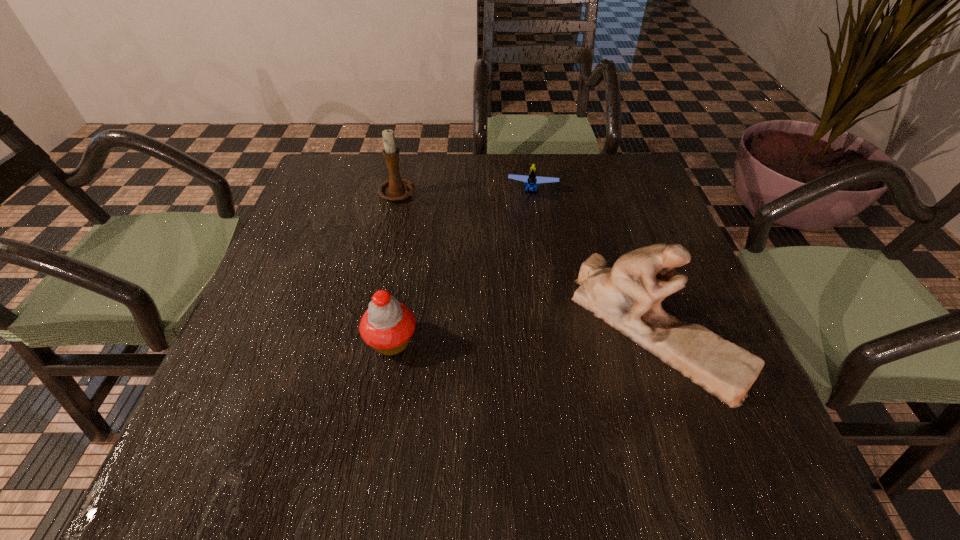
Identify the location of vacant space located 0.130m on the side of the candle holder with the handle. This screenshot has width=960, height=540. (433, 231).

The width and height of the screenshot is (960, 540). What are the coordinates of `Lego that is at the far edge` in the screenshot? It's located at (531, 181).

Locate an element on the screen. This screenshot has width=960, height=540. candle holder at the far edge is located at coordinates (396, 188).

Locate an element on the screen. Image resolution: width=960 pixels, height=540 pixels. object present at the near edge is located at coordinates (628, 296).

I want to click on object positioned at the right edge, so click(x=628, y=296).

Where is `object that is positioned at the near right corner`? The width and height of the screenshot is (960, 540). object that is positioned at the near right corner is located at coordinates (628, 296).

Where is `vacant space at the far edge of the desktop`? vacant space at the far edge of the desktop is located at coordinates (429, 193).

In the image, there is a desktop. Where is `vacant space at the near edge`? vacant space at the near edge is located at coordinates (309, 406).

I want to click on free space at the left edge, so click(276, 273).

Locate an element on the screen. This screenshot has width=960, height=540. free location at the right edge is located at coordinates (608, 221).